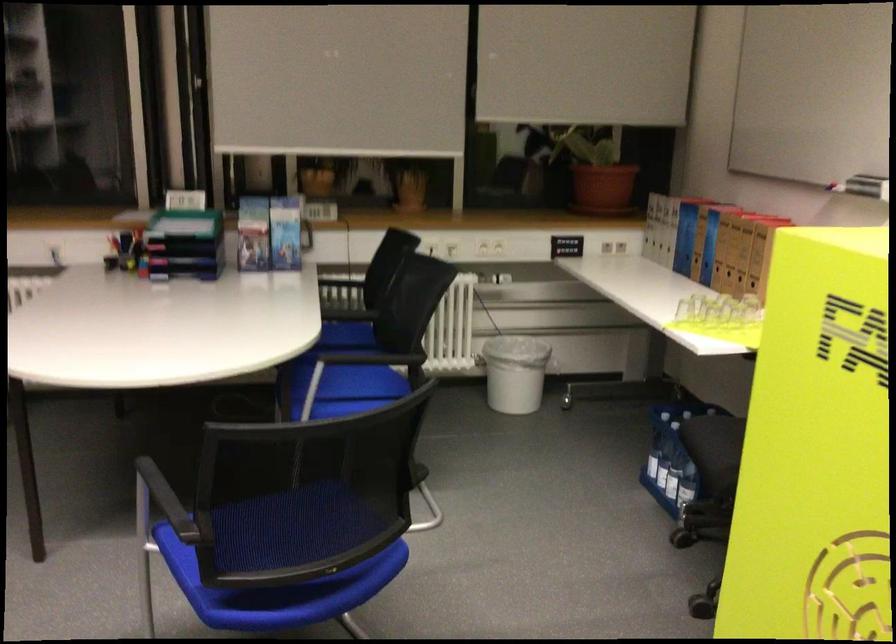
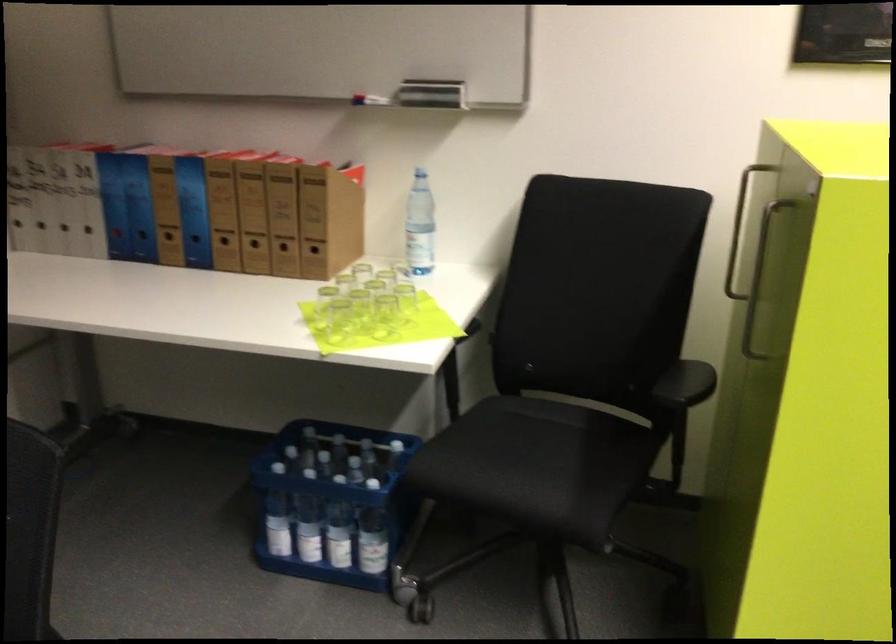
Where in the second image is the point corresponding to [719,267] from the first image?

(225, 245)